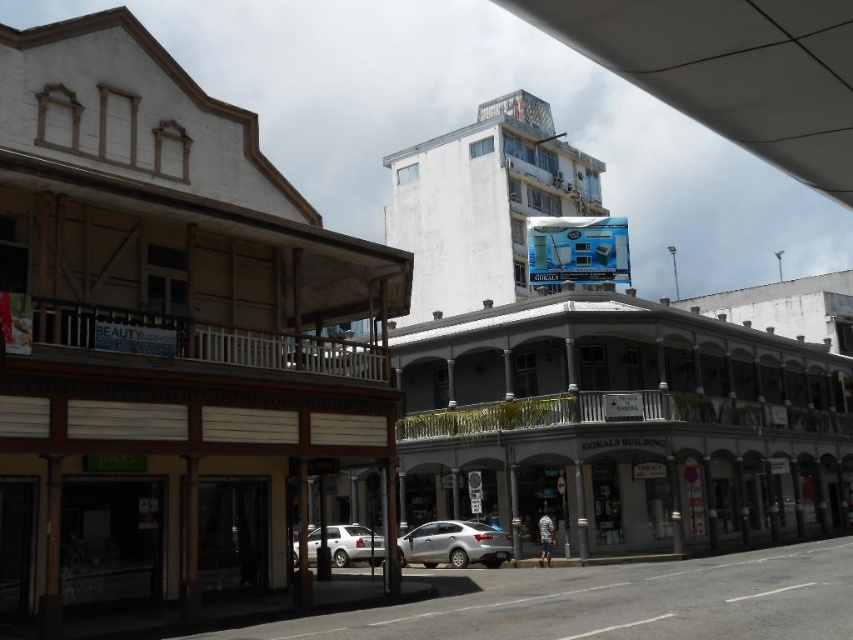
You are a delivery driver who needs to park your truck between the silver metallic sedan at center and the satin silver car at center. Your truck is 18 feet long. Based on the scene, can you fit your truck between them?

The distance between the silver metallic sedan at center and the satin silver car at center is 17.75 feet, which is shorter than your truck length of 18 feet. Therefore, you cannot fit your truck between them.